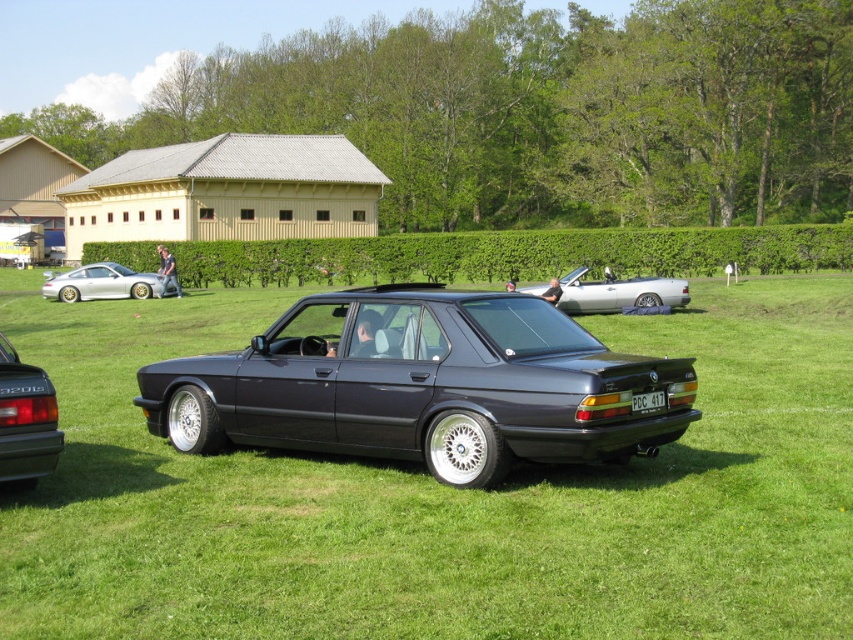
Question: Estimate the real-world distances between objects in this image. Which object is farther from the matte black sedan at lower left?

Choices:
 (A) silver metallic convertible at center
 (B) satin black sedan at center
 (C) green grass at center
 (D) silver metallic sports car at left

Answer: (D)

Question: Does silver metallic convertible at center have a larger size compared to silver metallic sports car at left?

Choices:
 (A) no
 (B) yes

Answer: (A)

Question: Does green leafy hedge at center have a greater width compared to white plastic license plate at center?

Choices:
 (A) yes
 (B) no

Answer: (A)

Question: Among these points, which one is farthest from the camera?

Choices:
 (A) (640, 410)
 (B) (22, 486)

Answer: (B)

Question: In this image, where is matte black sedan at lower left located relative to white plastic license plate at center?

Choices:
 (A) right
 (B) left

Answer: (B)

Question: Which object appears closest to the camera in this image?

Choices:
 (A) silver metallic convertible at center
 (B) white plastic license plate at center
 (C) matte black sedan at lower left

Answer: (C)